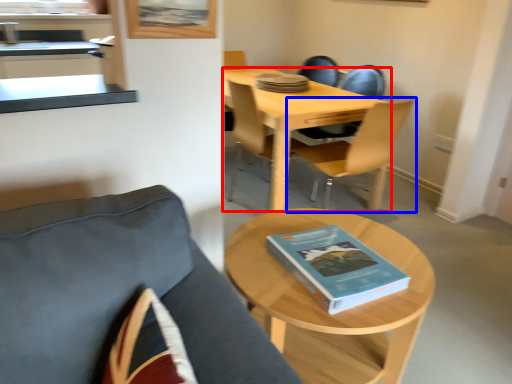
Question: Which object appears closest to the camera in this image, desk (highlighted by a red box) or chair (highlighted by a blue box)?

Choices:
 (A) desk
 (B) chair

Answer: (B)